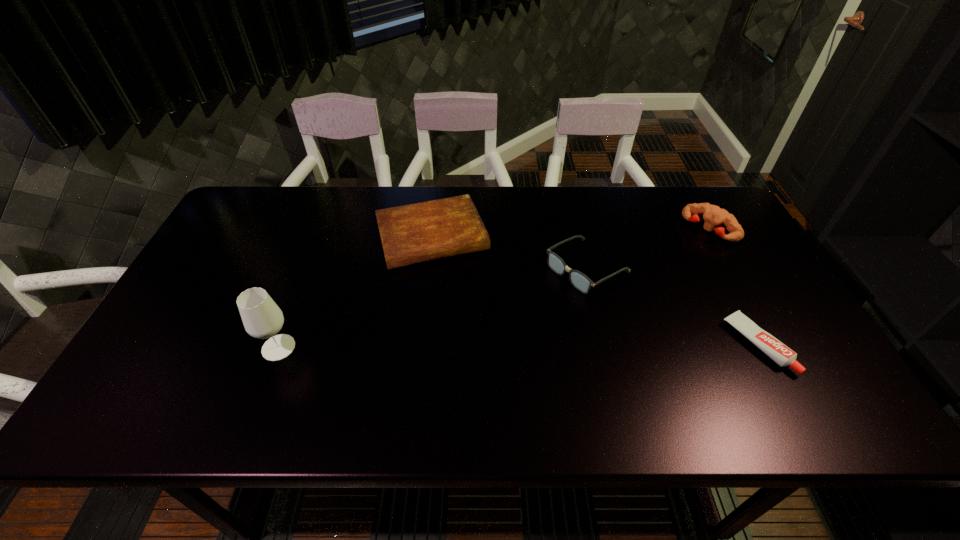
Locate an element on the screen. The width and height of the screenshot is (960, 540). puncher that is positioned at the far edge is located at coordinates (713, 215).

You are a GUI agent. You are given a task and a screenshot of the screen. Output one action in this format:
    pyautogui.click(x=<x>, y=<y>)
    Task: Click on the glass at the near edge
    This screenshot has height=540, width=960.
    Given the screenshot: What is the action you would take?
    pyautogui.click(x=262, y=318)

At what (x,y) coordinates should I click in order to perform the action: click on toothpaste that is at the near edge. Please return your answer as a coordinate pair (x, y). Looking at the image, I should click on (777, 351).

The height and width of the screenshot is (540, 960). What are the coordinates of `toothpaste that is at the right edge` in the screenshot? It's located at (777, 351).

Where is `puncher that is at the right edge`? puncher that is at the right edge is located at coordinates (713, 215).

At what (x,y) coordinates should I click in order to perform the action: click on object situated at the far right corner. Please return your answer as a coordinate pair (x, y). This screenshot has width=960, height=540. Looking at the image, I should click on (713, 215).

Image resolution: width=960 pixels, height=540 pixels. What are the coordinates of `object that is at the near right corner` in the screenshot? It's located at (777, 351).

Image resolution: width=960 pixels, height=540 pixels. Find the location of `free region at the far edge`. free region at the far edge is located at coordinates (584, 205).

At what (x,y) coordinates should I click in order to perform the action: click on vacant space at the near edge of the desktop. Please return your answer as a coordinate pair (x, y). The height and width of the screenshot is (540, 960). Looking at the image, I should click on (281, 382).

Where is `vacant space at the left edge of the desktop`? vacant space at the left edge of the desktop is located at coordinates (223, 299).